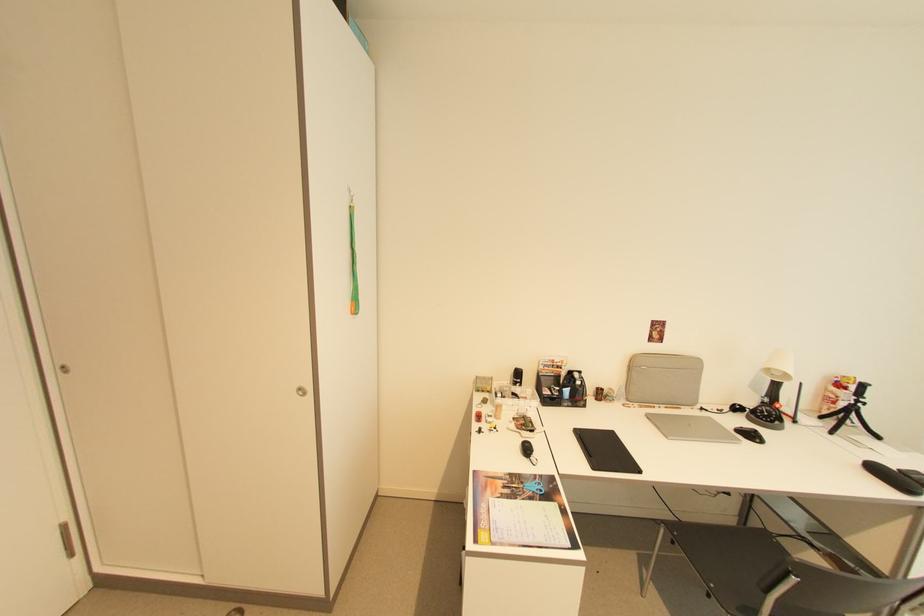
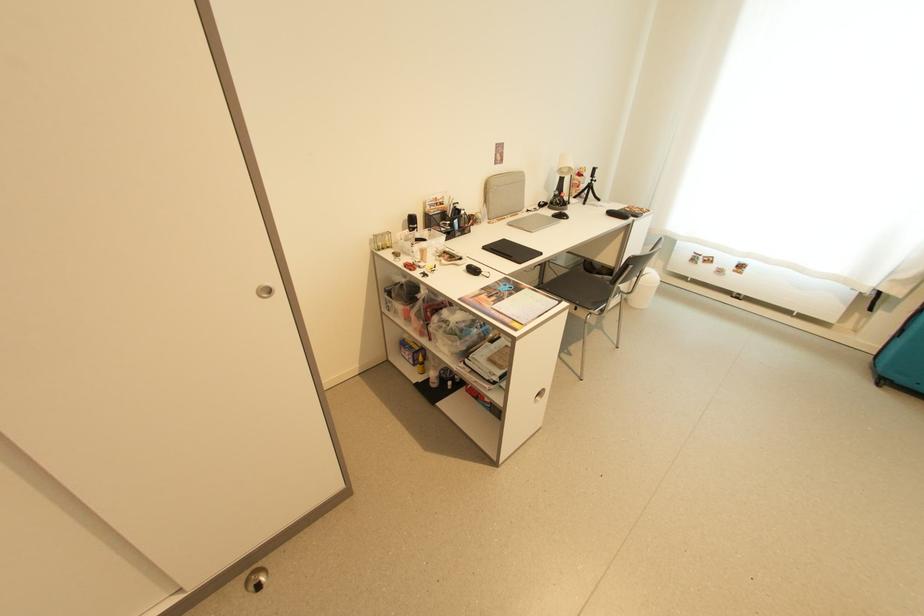
In the second image, find the point that corresponds to pixel 677 541 in the first image.

(552, 296)